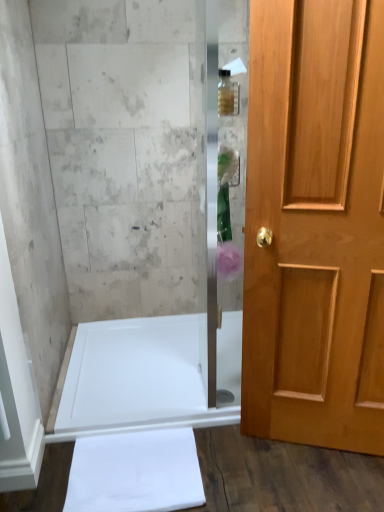
The height and width of the screenshot is (512, 384). Identify the location of vacant region to the left of light brown wooden door at right. (247, 464).